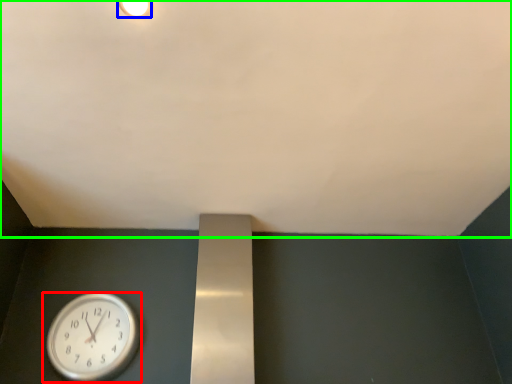
Question: Estimate the real-world distances between objects in this image. Which object is closer to wall clock (highlighted by a red box), light fixture (highlighted by a blue box) or backdrop (highlighted by a green box)?

Choices:
 (A) light fixture
 (B) backdrop

Answer: (B)